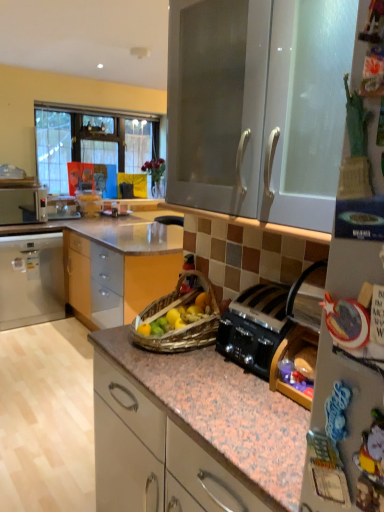
Question: From a real-world perspective, is white plastic microwave at left under black metallic toaster at center-right?

Choices:
 (A) yes
 (B) no

Answer: (B)

Question: From a real-world perspective, is white plastic microwave at left on black metallic toaster at center-right?

Choices:
 (A) yes
 (B) no

Answer: (A)

Question: Can you confirm if white plastic microwave at left is positioned to the right of black metallic toaster at center-right?

Choices:
 (A) no
 (B) yes

Answer: (A)

Question: From the image's perspective, would you say white plastic microwave at left is shown under black metallic toaster at center-right?

Choices:
 (A) yes
 (B) no

Answer: (B)

Question: Is white plastic microwave at left turned away from black metallic toaster at center-right?

Choices:
 (A) no
 (B) yes

Answer: (A)

Question: From the image's perspective, is black metallic toaster at center-right positioned above or below matte white cabinet at left, the second cabinetry from the front?

Choices:
 (A) below
 (B) above

Answer: (A)

Question: Looking at the image, does black metallic toaster at center-right seem bigger or smaller compared to matte white cabinet at left, the second cabinetry in the right-to-left sequence?

Choices:
 (A) small
 (B) big

Answer: (A)

Question: Is point (261, 311) closer or farther from the camera than point (54, 243)?

Choices:
 (A) farther
 (B) closer

Answer: (B)

Question: In the image, is black metallic toaster at center-right positioned in front of or behind matte white cabinet at left, the second cabinetry in the right-to-left sequence?

Choices:
 (A) behind
 (B) front

Answer: (B)

Question: Considering the positions of white glossy cabinet at upper center, the first cabinetry in the right-to-left sequence, and black metallic toaster at center-right in the image, is white glossy cabinet at upper center, the first cabinetry in the right-to-left sequence, wider or thinner than black metallic toaster at center-right?

Choices:
 (A) thin
 (B) wide

Answer: (B)

Question: Is white glossy cabinet at upper center, the first cabinetry from the front, inside the boundaries of black metallic toaster at center-right, or outside?

Choices:
 (A) inside
 (B) outside

Answer: (B)

Question: Considering their positions, is white glossy cabinet at upper center, which is the 2th cabinetry from left to right, located in front of or behind black metallic toaster at center-right?

Choices:
 (A) behind
 (B) front

Answer: (B)

Question: Looking at the image, does white glossy cabinet at upper center, which is the 2th cabinetry from left to right, seem bigger or smaller compared to black metallic toaster at center-right?

Choices:
 (A) small
 (B) big

Answer: (B)

Question: From a real-world perspective, is white glossy cabinet at upper center, which is the 2th cabinetry from left to right, physically located above or below white plastic microwave at left?

Choices:
 (A) above
 (B) below

Answer: (A)

Question: Is white glossy cabinet at upper center, the first cabinetry in the right-to-left sequence, situated inside white plastic microwave at left or outside?

Choices:
 (A) inside
 (B) outside

Answer: (B)